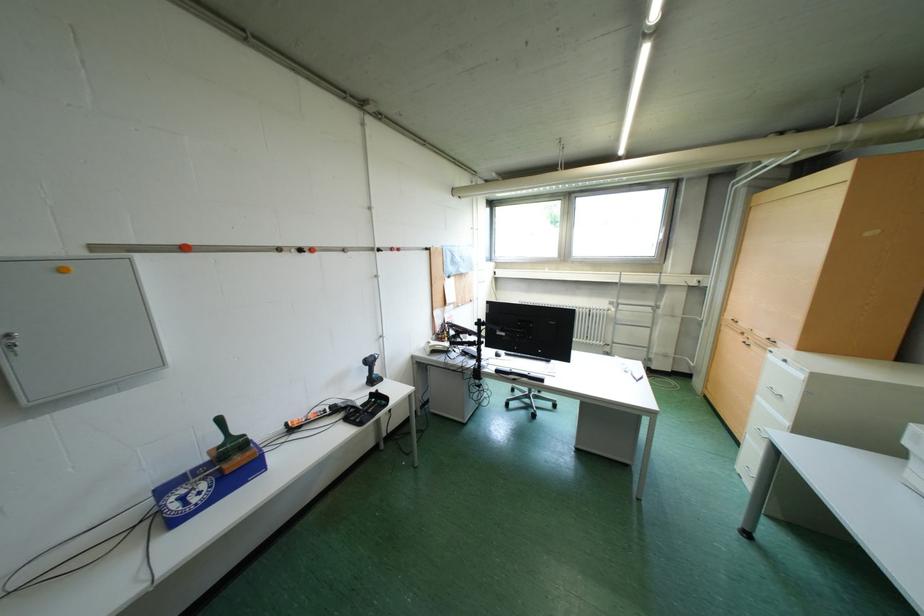
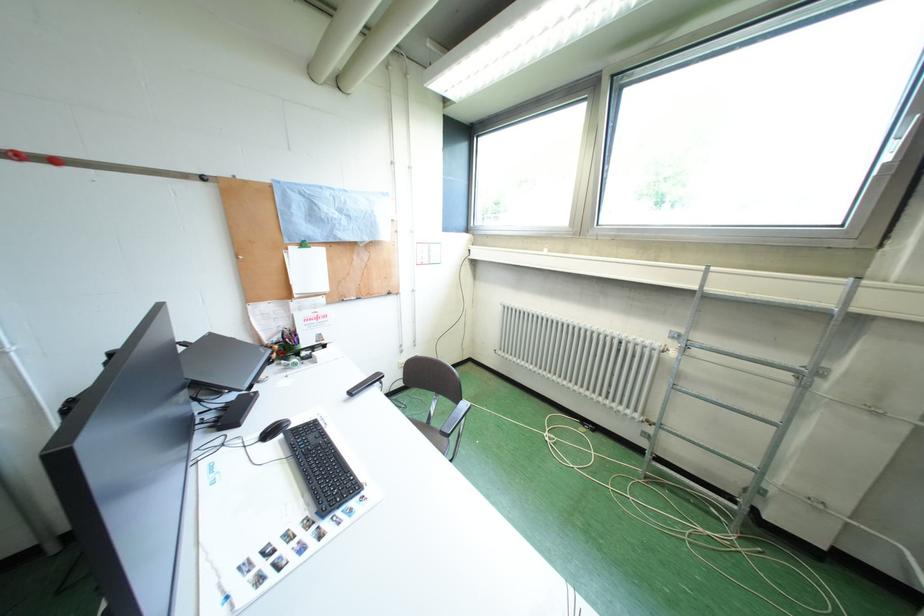
In a continuous first-person perspective shot, in which direction is the camera moving?

The cameraman walked toward right, forward.